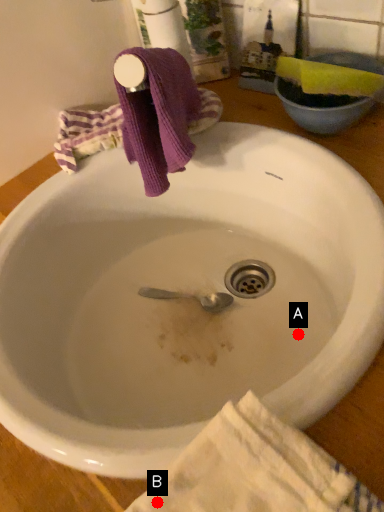
Question: Two points are circled on the image, labeled by A and B beside each circle. Which point is farther from the camera taking this photo?

Choices:
 (A) A is further
 (B) B is further

Answer: (A)